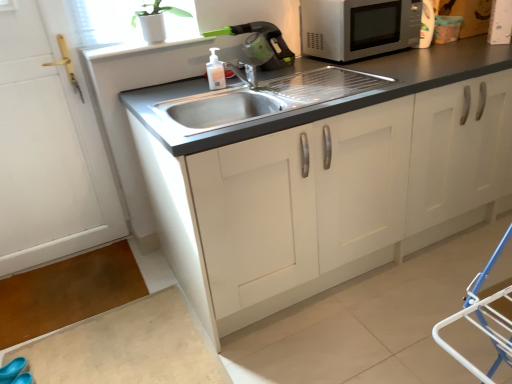
Find the location of a particular element. The width and height of the screenshot is (512, 384). free space to the back side of blue rubber shoe at lower left is located at coordinates (44, 352).